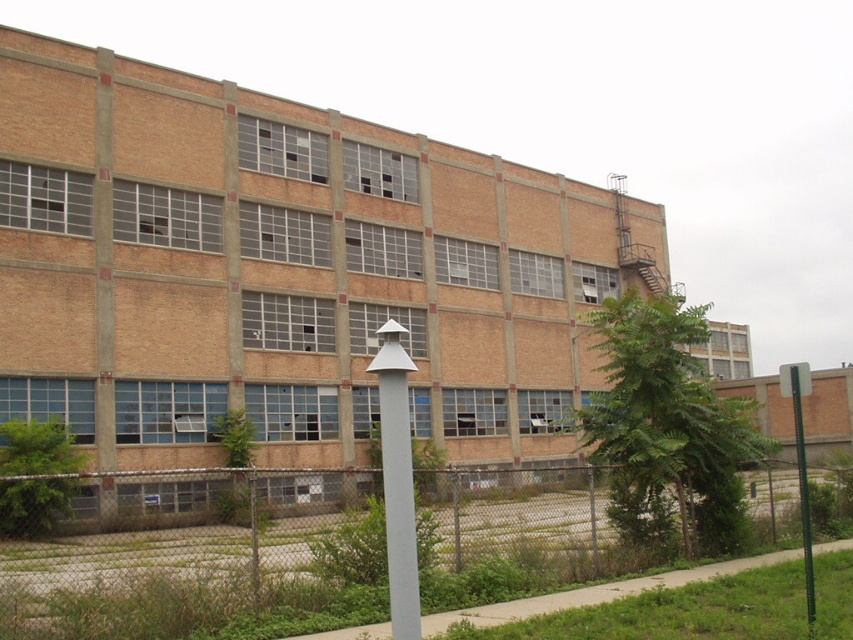
Can you confirm if chain-link fence at lower center is wider than green metallic pole at right?

Incorrect, chain-link fence at lower center's width does not surpass green metallic pole at right's.

Based on the photo, between chain-link fence at lower center and green metallic pole at right, which one has less height?

chain-link fence at lower center is shorter.

The image size is (853, 640). Identify the location of chain-link fence at lower center. (210, 568).

Is brown brick building at center further to camera compared to green metallic pole at right?

Yes, brown brick building at center is further from the viewer.

Can you confirm if brown brick building at center is positioned above green metallic pole at right?

Yes.

Which is in front, point (480, 352) or point (811, 628)?

Positioned in front is point (811, 628).

Locate an element on the screen. The height and width of the screenshot is (640, 853). brown brick building at center is located at coordinates (283, 269).

Can you confirm if white matte pole at center is positioned to the left of green metallic pole at right?

Indeed, white matte pole at center is positioned on the left side of green metallic pole at right.

Is point (386, 397) farther from camera compared to point (805, 371)?

No, (386, 397) is closer to viewer.

Is point (381, 333) positioned after point (802, 448)?

No, (381, 333) is in front of (802, 448).

In order to click on white matte pole at center in this screenshot , I will do `click(397, 480)`.